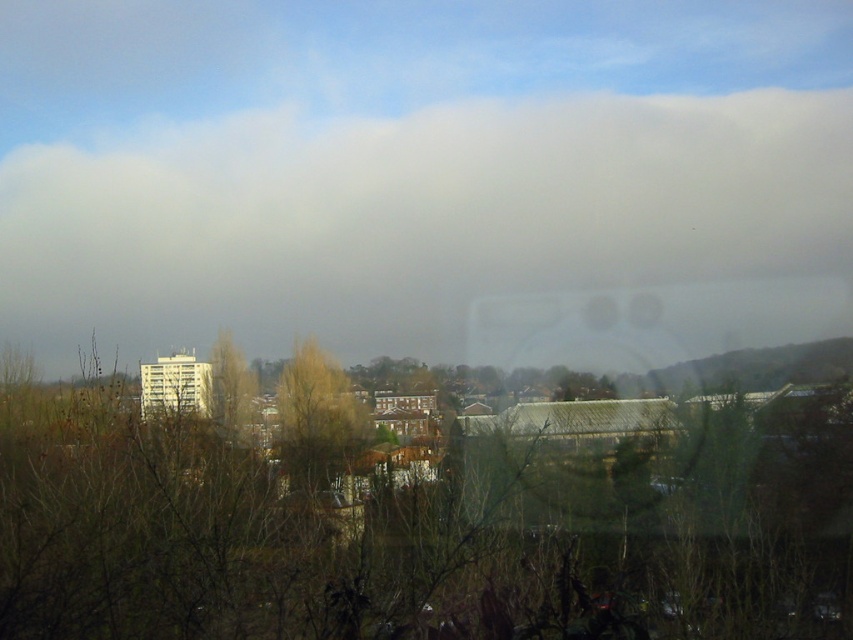
Question: Is brown textured tree at center wider than green matte tree at center?

Choices:
 (A) no
 (B) yes

Answer: (B)

Question: Which point appears closest to the camera in this image?

Choices:
 (A) (213, 408)
 (B) (436, 576)
 (C) (345, 236)
 (D) (308, 362)

Answer: (B)

Question: Is brown leafless tree at center to the right of brown textured tree at center from the viewer's perspective?

Choices:
 (A) yes
 (B) no

Answer: (A)

Question: Which object is farther from the camera taking this photo?

Choices:
 (A) brown textured tree at center
 (B) green matte tree at center

Answer: (A)

Question: Is brown leafless tree at center above green matte tree at center?

Choices:
 (A) yes
 (B) no

Answer: (B)

Question: Which object is farther from the camera taking this photo?

Choices:
 (A) green matte tree at center
 (B) brown leafless tree at center

Answer: (A)